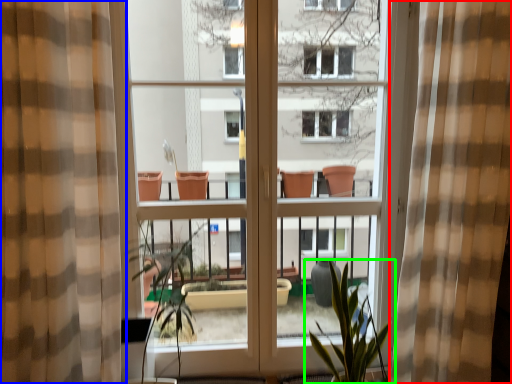
Question: Which is farther away from curtain (highlighted by a red box)? curtain (highlighted by a blue box) or houseplant (highlighted by a green box)?

Choices:
 (A) curtain
 (B) houseplant

Answer: (A)